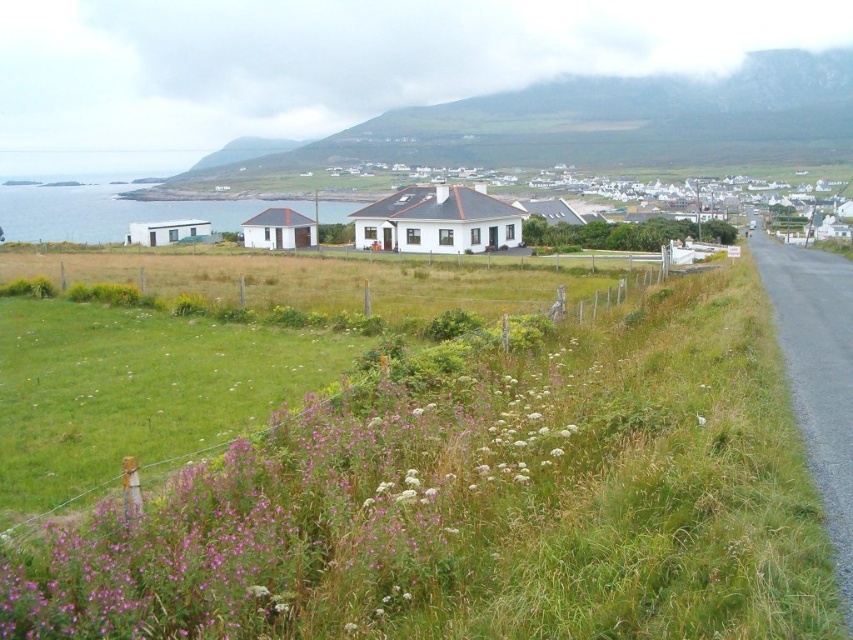
Question: Which of the following is the closest to the observer?

Choices:
 (A) green grassy hillside at upper center
 (B) white matte house at center
 (C) purple soft grass at lower left

Answer: (C)

Question: Is purple soft grass at lower left above green grassy hillside at upper center?

Choices:
 (A) no
 (B) yes

Answer: (A)

Question: Based on their relative distances, which object is nearer to the green grassy hillside at upper center?

Choices:
 (A) purple soft grass at lower left
 (B) white matte house at center

Answer: (B)

Question: Does purple soft grass at lower left have a smaller size compared to white matte house at center?

Choices:
 (A) yes
 (B) no

Answer: (A)

Question: Among these objects, which one is nearest to the camera?

Choices:
 (A) white matte house at center
 (B) green grassy hillside at upper center

Answer: (A)

Question: Does purple soft grass at lower left come behind green grassy hillside at upper center?

Choices:
 (A) yes
 (B) no

Answer: (B)